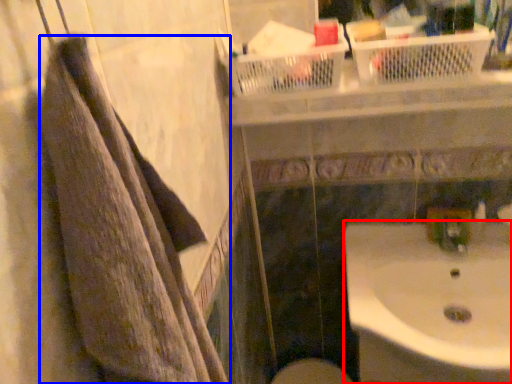
Question: Which object appears closest to the camera in this image, sink (highlighted by a red box) or towel (highlighted by a blue box)?

Choices:
 (A) sink
 (B) towel

Answer: (B)